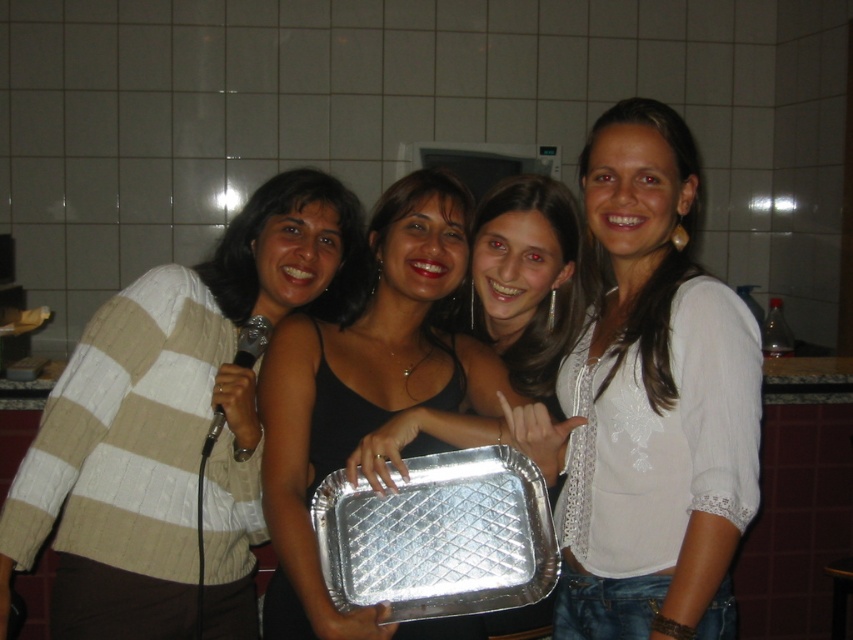
What is the 2D coordinate of the white knit sweater at left in the image?

The white knit sweater at left is located at the 2D coordinate point of [171,428].

In the kitchen scene, you need to determine which object is taller between the white embroidered shirt at center and the metallic silver tray at center. Based on the description, which one is taller?

The white embroidered shirt at center is taller than the metallic silver tray at center according to the description.